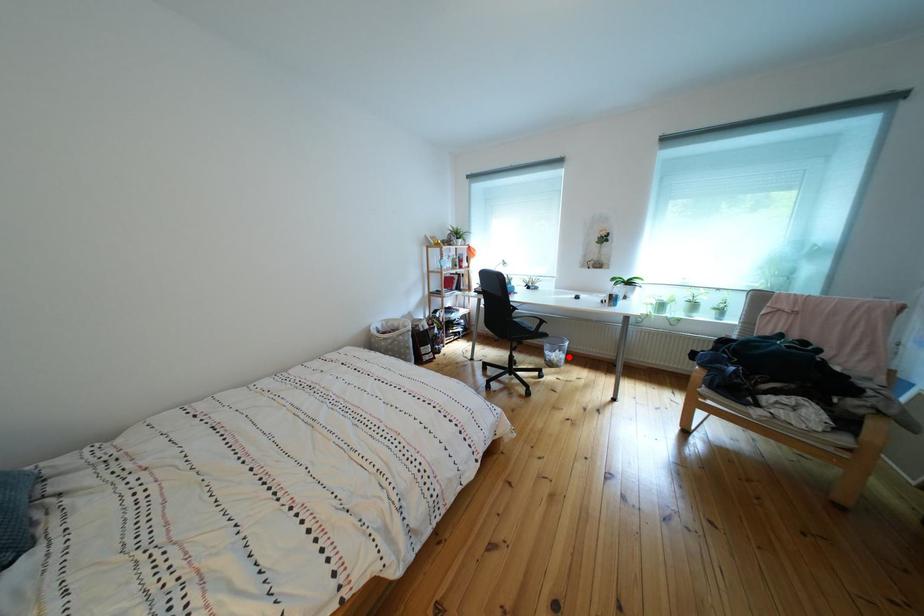
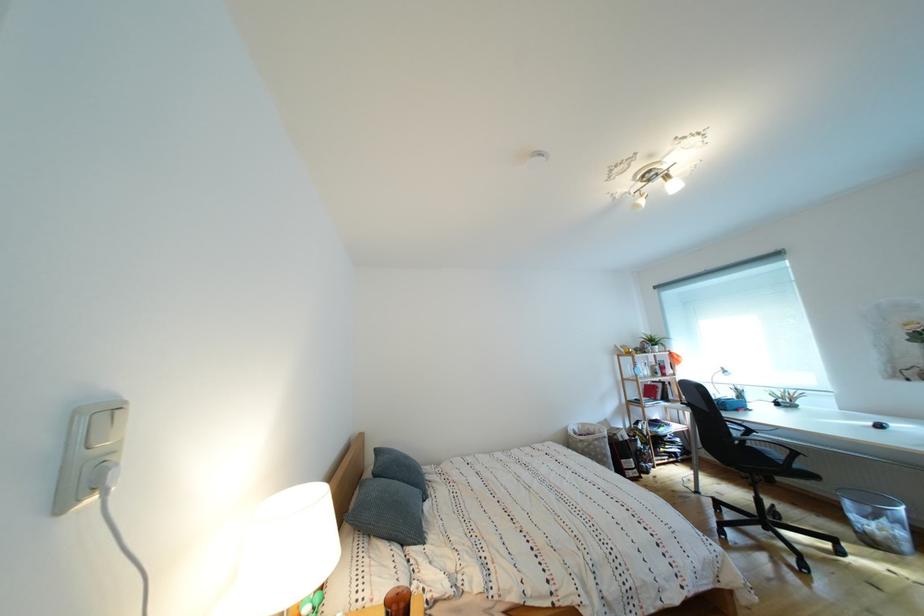
Find the pixel in the second image that matches the highlighted location in the first image.

(896, 527)